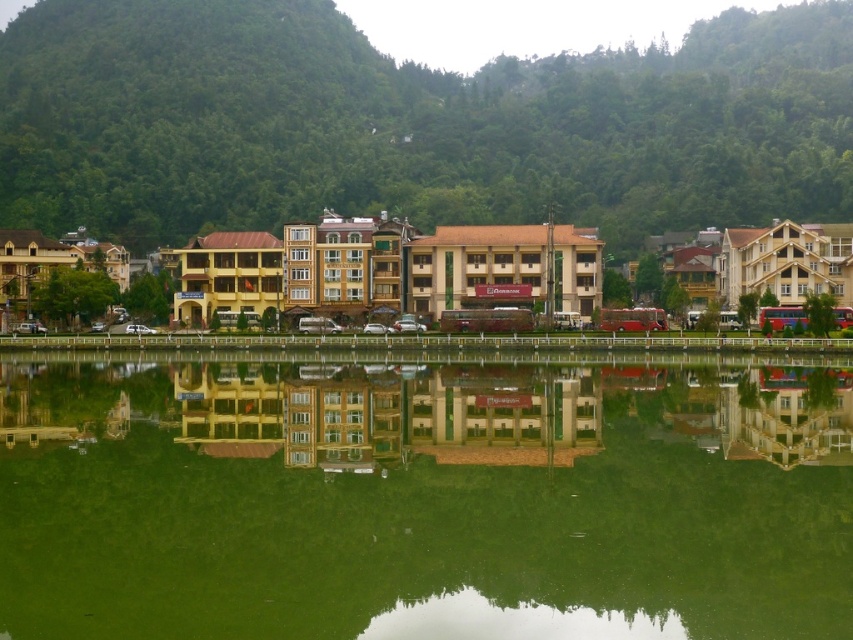
You are standing at the lakeside and want to take a photo that includes both the green reflective water at center and the green leafy hillside at upper center. Which object should you position closer to the left side of your camera frame?

You should position the green leafy hillside at upper center closer to the left side of your camera frame because the green reflective water at center is to the right of it.

You are standing at the lakeside and want to compare the height of the green reflective water at center and the green leafy hillside at upper center. Which one is taller?

The green leafy hillside at upper center is taller than the green reflective water at center.

You are standing at the lakeside and want to take a photo that includes both the green reflective water at center and the green leafy hillside at upper center. Which object will occupy less space in your photo?

The green reflective water at center will occupy less space in the photo because it has a smaller size compared to the green leafy hillside at upper center.